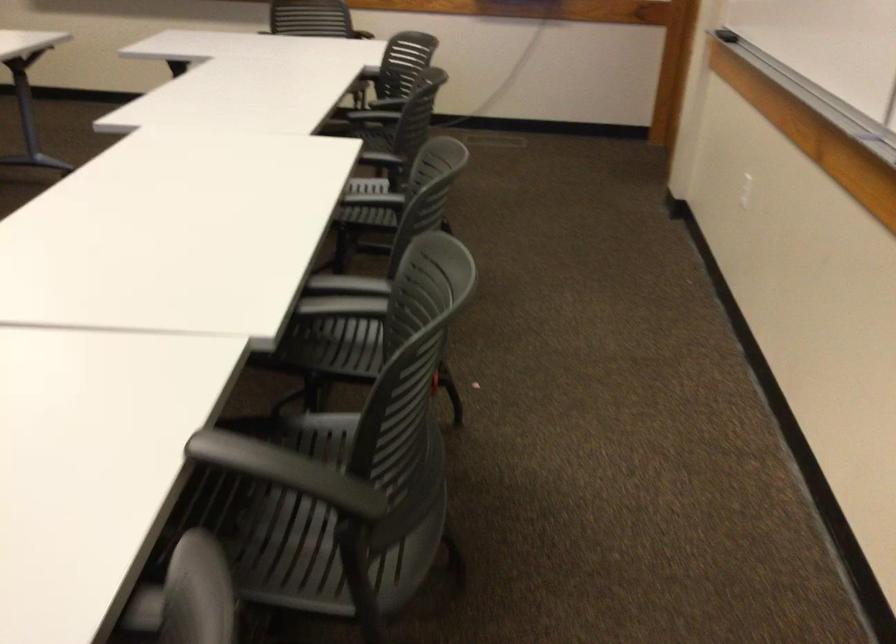
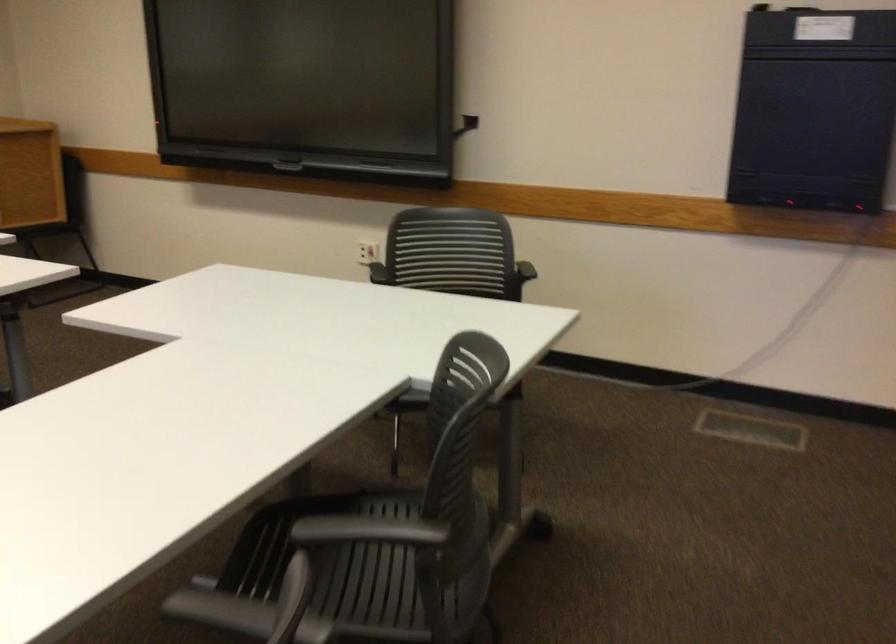
Question: The images are taken continuously from a first-person perspective. In which direction are you moving?

Choices:
 (A) Left
 (B) Right
 (C) Forward
 (D) Backward

Answer: (C)